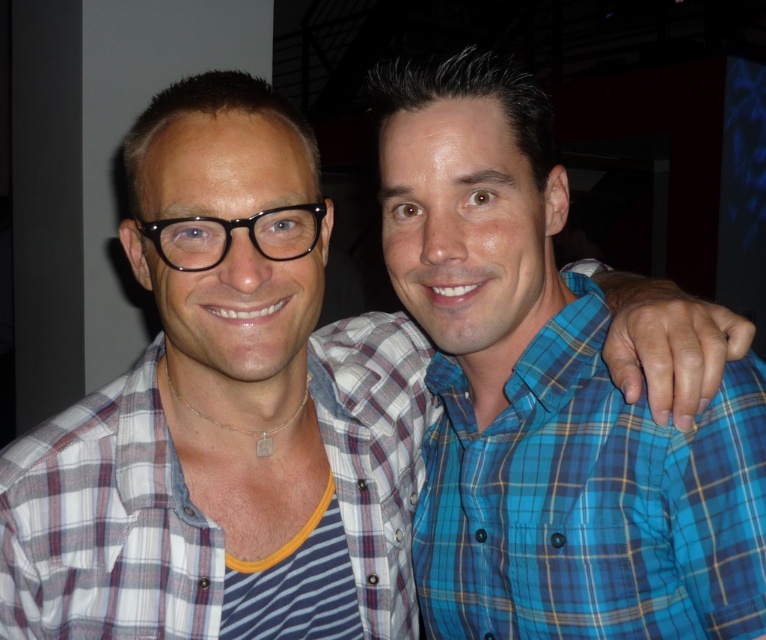
Question: Among these points, which one is farthest from the camera?

Choices:
 (A) (352, 524)
 (B) (558, 364)

Answer: (A)

Question: Which point is farther to the camera?

Choices:
 (A) white plaid shirt at center
 (B) blue plaid shirt at right

Answer: (A)

Question: Is blue plaid shirt at right further to camera compared to white plaid shirt at center?

Choices:
 (A) yes
 (B) no

Answer: (B)

Question: Considering the relative positions of blue plaid shirt at right and white plaid shirt at center in the image provided, where is blue plaid shirt at right located with respect to white plaid shirt at center?

Choices:
 (A) left
 (B) right

Answer: (B)

Question: Does blue plaid shirt at right have a greater width compared to white plaid shirt at center?

Choices:
 (A) no
 (B) yes

Answer: (A)